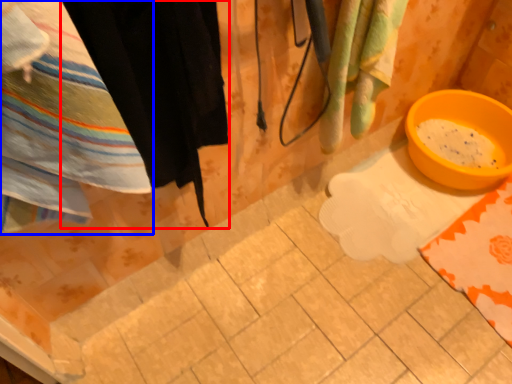
Question: Among these objects, which one is nearest to the camera, clothing (highlighted by a red box) or towel (highlighted by a blue box)?

Choices:
 (A) clothing
 (B) towel

Answer: (B)